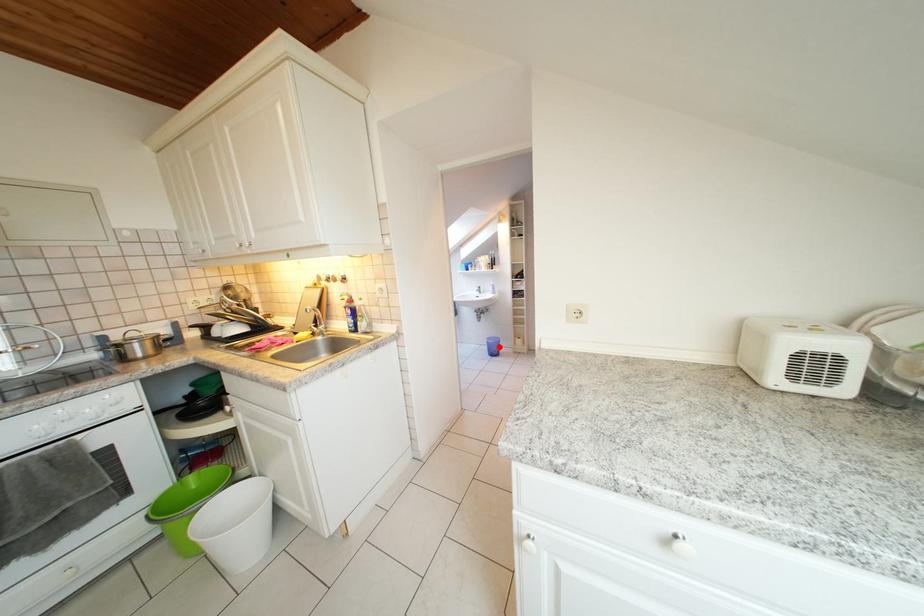
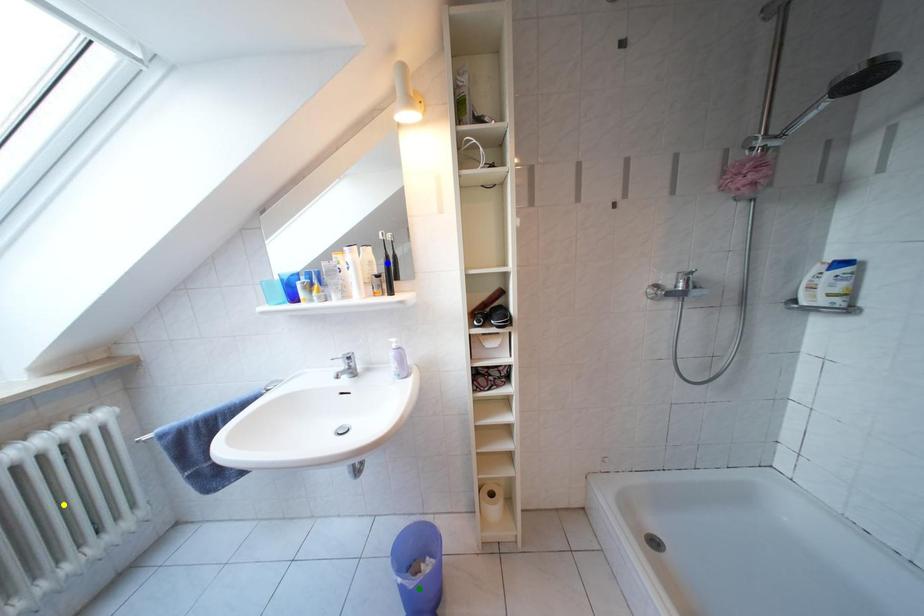
Question: I am providing you with two images of the same scene from different viewpoints. A red point is marked on the first image. You are given multiple points on the second image. Which mark in image 2 goes with the point in image 1?

Choices:
 (A) yellow point
 (B) blue point
 (C) green point

Answer: (C)